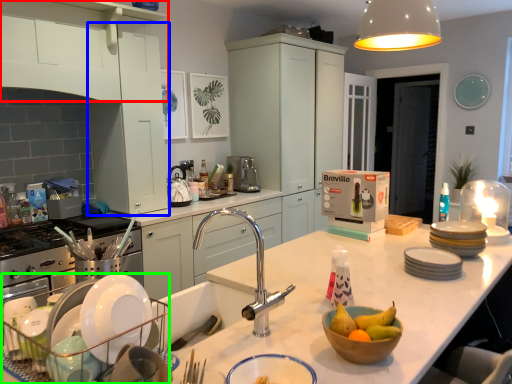
Question: Estimate the real-world distances between objects in this image. Which object is farther from cabinetry (highlighted by a red box), cabinetry (highlighted by a blue box) or appliance (highlighted by a green box)?

Choices:
 (A) cabinetry
 (B) appliance

Answer: (B)